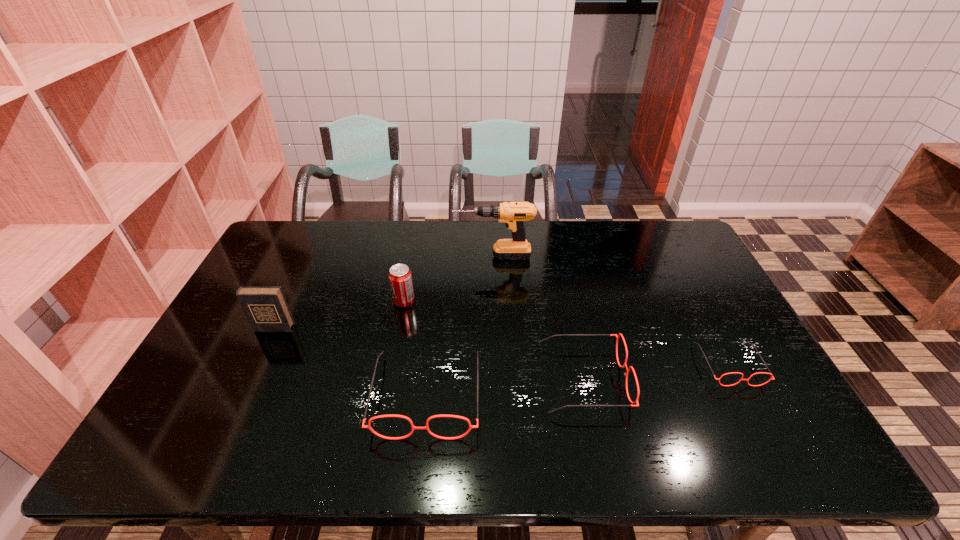
This screenshot has width=960, height=540. I want to click on free space between the tallest object and the second farthest object, so click(x=448, y=279).

Where is `unoccupied position between the second farthest object and the farthest object`? unoccupied position between the second farthest object and the farthest object is located at coordinates pos(448,279).

At what (x,y) coordinates should I click in order to perform the action: click on vacant point located between the leftmost spectacles and the shortest spectacles. Please return your answer as a coordinate pair (x, y). This screenshot has height=540, width=960. Looking at the image, I should click on (578, 379).

Locate an element on the screen. empty location between the rightmost spectacles and the tallest object is located at coordinates (611, 310).

Locate an element on the screen. free spot between the shortest object and the tallest object is located at coordinates (611, 310).

Locate an element on the screen. the fourth closest object relative to the second shortest object is located at coordinates (400, 277).

This screenshot has width=960, height=540. In order to click on object identified as the fifth closest to the leftmost spectacles in this screenshot , I will do `click(771, 378)`.

Select which spectacles appears as the second closest to the shortest object. Please provide its 2D coordinates. Your answer should be formatted as a tuple, i.e. [(x, y)], where the tuple contains the x and y coordinates of a point satisfying the conditions above.

[(368, 426)]

You are a GUI agent. You are given a task and a screenshot of the screen. Output one action in this format:
    pyautogui.click(x=<x>, y=<y>)
    Task: Click on the spectacles that is the closest to the leftmost spectacles
    The image size is (960, 540).
    Given the screenshot: What is the action you would take?
    click(617, 337)

Image resolution: width=960 pixels, height=540 pixels. Find the location of `vacant region that satisfies the following two spatial constraints: 1. at the tip of the drill; 2. on the front cover of the leftmost object`. vacant region that satisfies the following two spatial constraints: 1. at the tip of the drill; 2. on the front cover of the leftmost object is located at coordinates tap(495, 328).